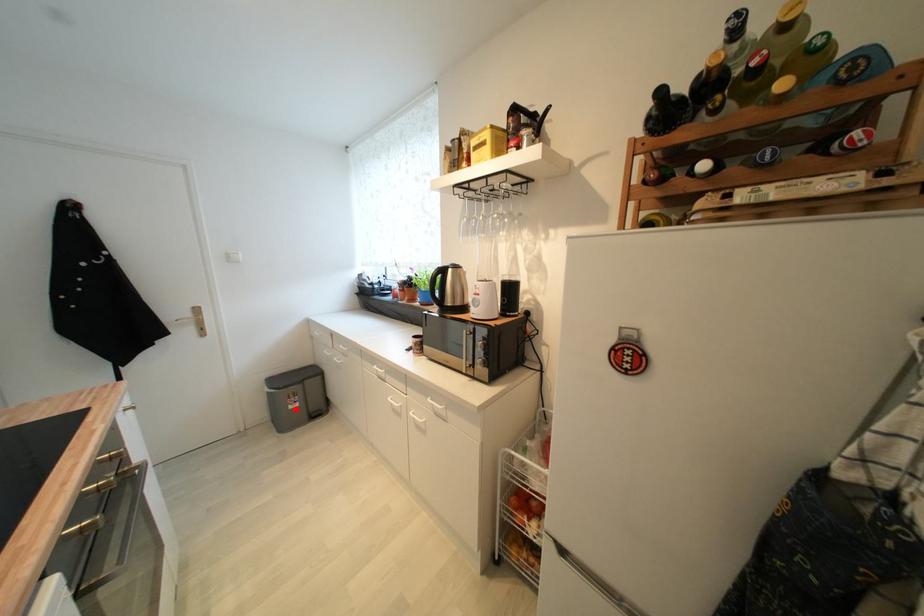
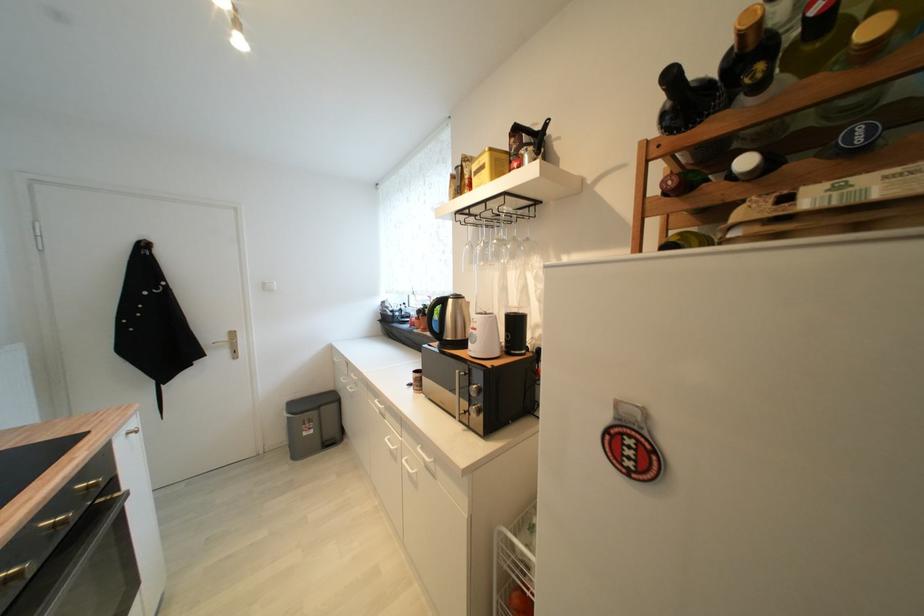
Find the pixel in the second image that matches the highlighted location in the first image.

(310, 436)